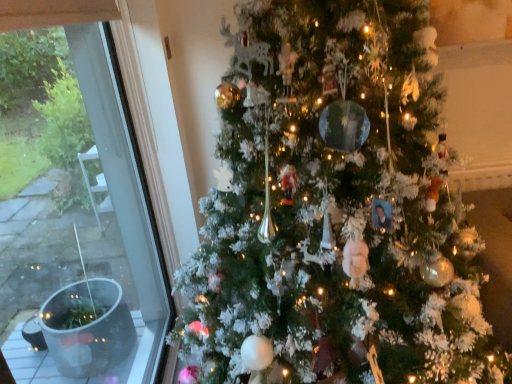
Question: From the image's perspective, is white frosted christmas tree at center on top of transparent glass window at left?

Choices:
 (A) no
 (B) yes

Answer: (B)

Question: Is white frosted christmas tree at center bigger than transparent glass window at left?

Choices:
 (A) yes
 (B) no

Answer: (A)

Question: Could you tell me if white frosted christmas tree at center is facing transparent glass window at left?

Choices:
 (A) no
 (B) yes

Answer: (A)

Question: Can transparent glass window at left be found inside white frosted christmas tree at center?

Choices:
 (A) yes
 (B) no

Answer: (B)

Question: Is white frosted christmas tree at center positioned with its back to transparent glass window at left?

Choices:
 (A) yes
 (B) no

Answer: (B)

Question: Is white frosted christmas tree at center behind transparent glass window at left?

Choices:
 (A) no
 (B) yes

Answer: (A)

Question: Can you confirm if transparent glass window at left is bigger than white frosted christmas tree at center?

Choices:
 (A) no
 (B) yes

Answer: (A)

Question: Is transparent glass window at left behind white frosted christmas tree at center?

Choices:
 (A) no
 (B) yes

Answer: (B)

Question: Considering the relative sizes of transparent glass window at left and white frosted christmas tree at center in the image provided, is transparent glass window at left shorter than white frosted christmas tree at center?

Choices:
 (A) no
 (B) yes

Answer: (B)

Question: Would you say white frosted christmas tree at center is part of transparent glass window at left's contents?

Choices:
 (A) no
 (B) yes

Answer: (A)

Question: Can you confirm if transparent glass window at left is taller than white frosted christmas tree at center?

Choices:
 (A) no
 (B) yes

Answer: (A)

Question: Is transparent glass window at left in contact with white frosted christmas tree at center?

Choices:
 (A) no
 (B) yes

Answer: (A)

Question: Relative to transparent glass window at left, is white frosted christmas tree at center in front or behind?

Choices:
 (A) behind
 (B) front

Answer: (B)